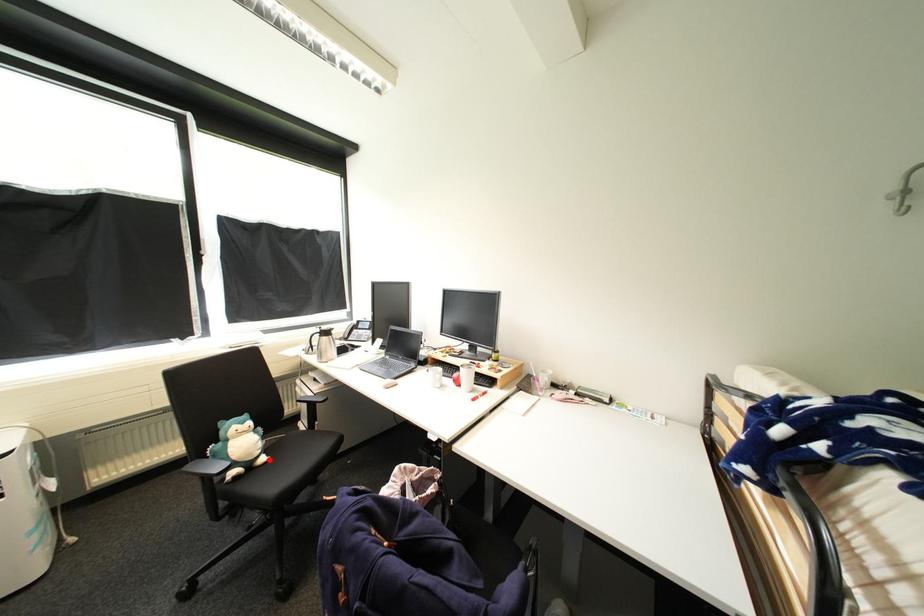
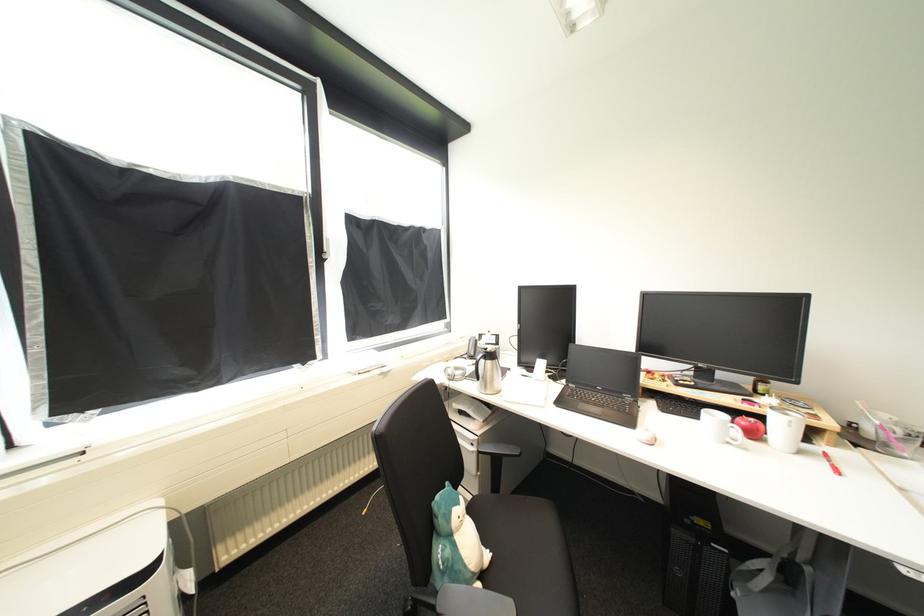
Question: I am providing you with two images of the same scene from different viewpoints. Image1 has a red point marked. In image2, the corresponding 3D location appears at what relative position? Reply with the corresponding letter.

Choices:
 (A) Closer
 (B) Farther

Answer: (B)